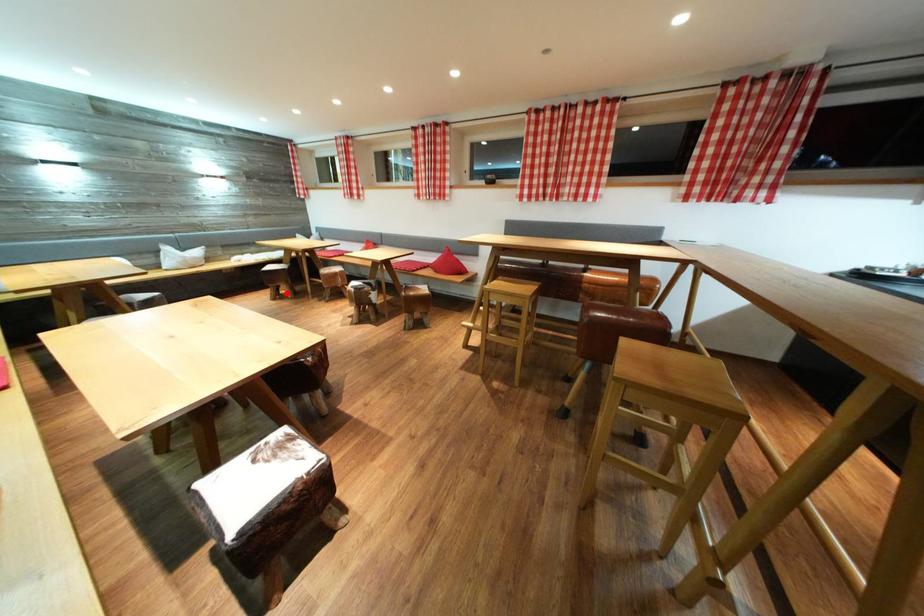
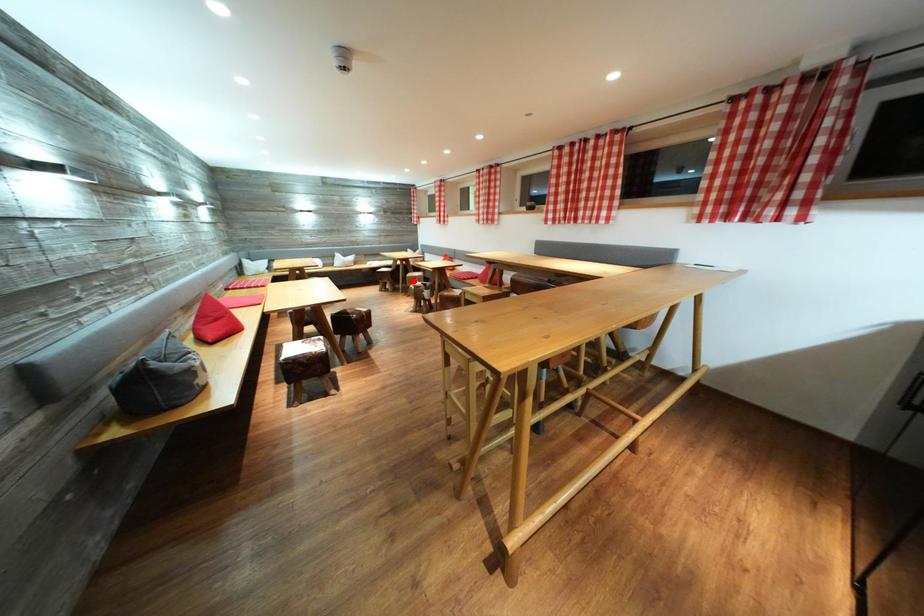
I am providing you with two images of the same scene from different viewpoints. A red point is marked on the first image and another point is marked on the second image. Do the highlighted points in image1 and image2 indicate the same real-world spot?

No